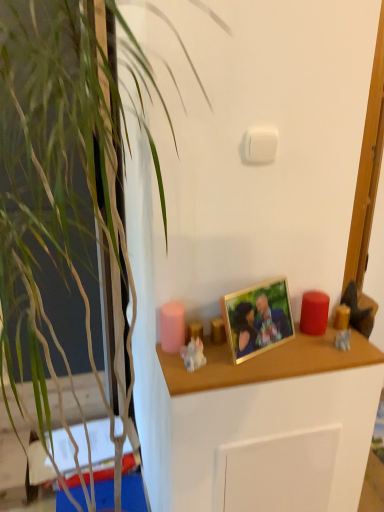
Question: From the image's perspective, does translucent amber glass candle at right, which is the third candle from left to right, appear lower than porcelain figurine at center, the second toy viewed from the back?

Choices:
 (A) no
 (B) yes

Answer: (A)

Question: Does translucent amber glass candle at right, positioned as the first candle in right-to-left order, come in front of porcelain figurine at center, positioned as the first toy in front-to-back order?

Choices:
 (A) yes
 (B) no

Answer: (B)

Question: Is translucent amber glass candle at right, which is the third candle from left to right, next to porcelain figurine at center, the second toy viewed from the back?

Choices:
 (A) yes
 (B) no

Answer: (B)

Question: From the image's perspective, is translucent amber glass candle at right, which is the third candle from left to right, on top of porcelain figurine at center, positioned as the first toy in front-to-back order?

Choices:
 (A) no
 (B) yes

Answer: (B)

Question: Is translucent amber glass candle at right, which is the third candle from left to right, bigger than porcelain figurine at center, positioned as the first toy in front-to-back order?

Choices:
 (A) yes
 (B) no

Answer: (B)

Question: In the image, is white plastic light switch at upper center on the left side or the right side of red matte candle at right, the 2th candle positioned from the right?

Choices:
 (A) right
 (B) left

Answer: (B)

Question: Is point (251, 156) positioned closer to the camera than point (319, 294)?

Choices:
 (A) farther
 (B) closer

Answer: (B)

Question: Would you say white plastic light switch at upper center is inside or outside red matte candle at right, the 2th candle positioned from the right?

Choices:
 (A) inside
 (B) outside

Answer: (B)

Question: Is white plastic light switch at upper center in front of or behind red matte candle at right, the second candle viewed from the left, in the image?

Choices:
 (A) behind
 (B) front

Answer: (B)

Question: From the image's perspective, is pink matte candle at center, acting as the 3th candle starting from the right, located above or below wooden shelf at center?

Choices:
 (A) below
 (B) above

Answer: (B)

Question: From a real-world perspective, relative to wooden shelf at center, is pink matte candle at center, positioned as the 1th candle in left-to-right order, vertically above or below?

Choices:
 (A) above
 (B) below

Answer: (A)

Question: Considering the positions of pink matte candle at center, acting as the 3th candle starting from the right, and wooden shelf at center in the image, is pink matte candle at center, acting as the 3th candle starting from the right, bigger or smaller than wooden shelf at center?

Choices:
 (A) big
 (B) small

Answer: (B)

Question: Considering the positions of pink matte candle at center, positioned as the 1th candle in left-to-right order, and wooden shelf at center in the image, is pink matte candle at center, positioned as the 1th candle in left-to-right order, taller or shorter than wooden shelf at center?

Choices:
 (A) tall
 (B) short

Answer: (A)

Question: Relative to translucent amber glass candle at right, which is the third candle from left to right, is wooden shelf at center in front or behind?

Choices:
 (A) front
 (B) behind

Answer: (A)

Question: Does point [x=355, y=335] appear closer or farther from the camera than point [x=337, y=306]?

Choices:
 (A) closer
 (B) farther

Answer: (A)